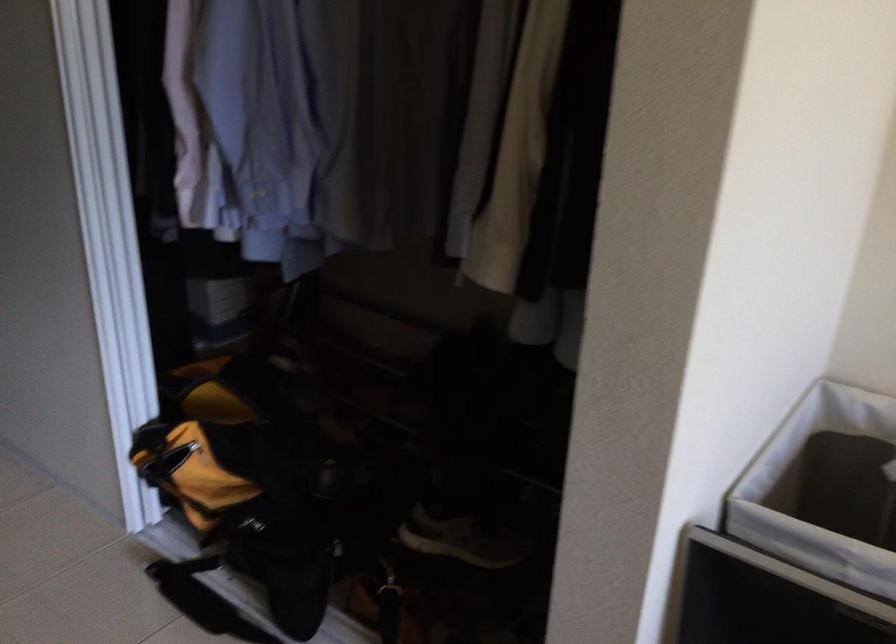
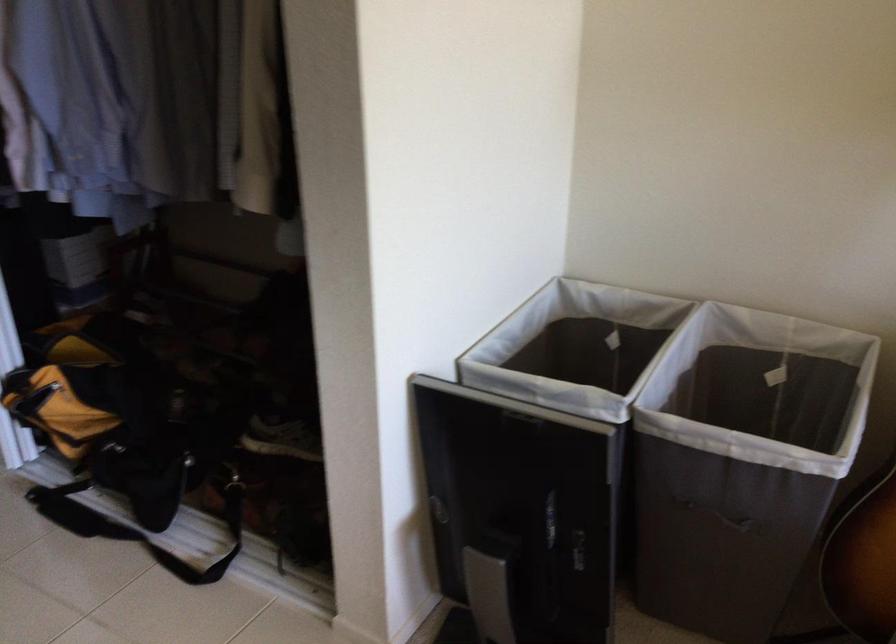
Find the pixel in the second image that matches (x=245, y=509) in the first image.

(110, 433)